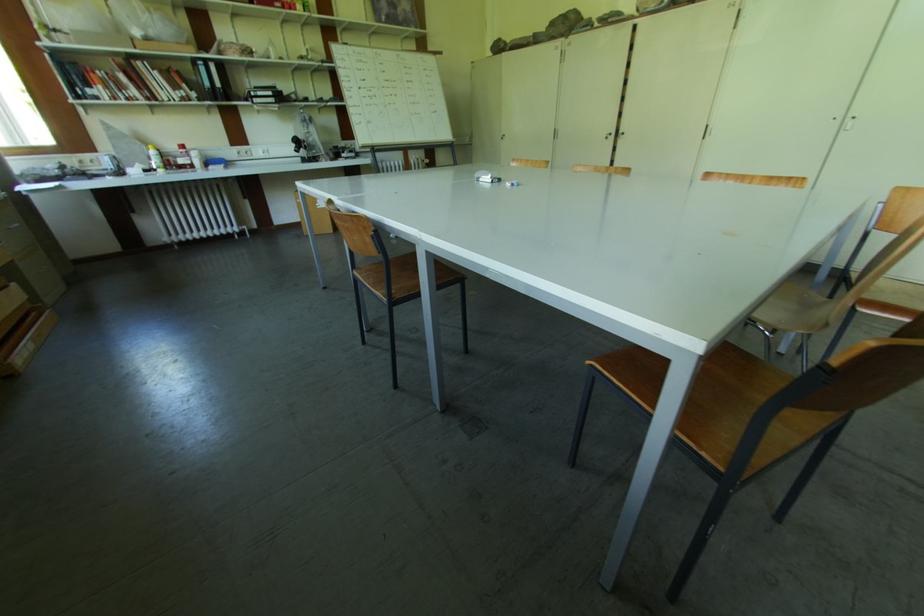
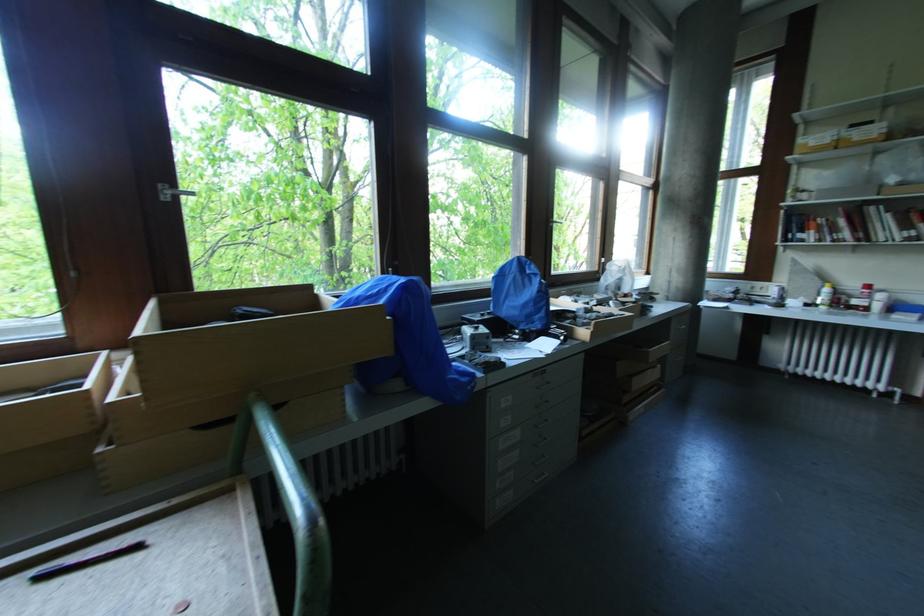
Where in the second image is the point corresponding to the point at 186,148 from the first image?

(871, 288)